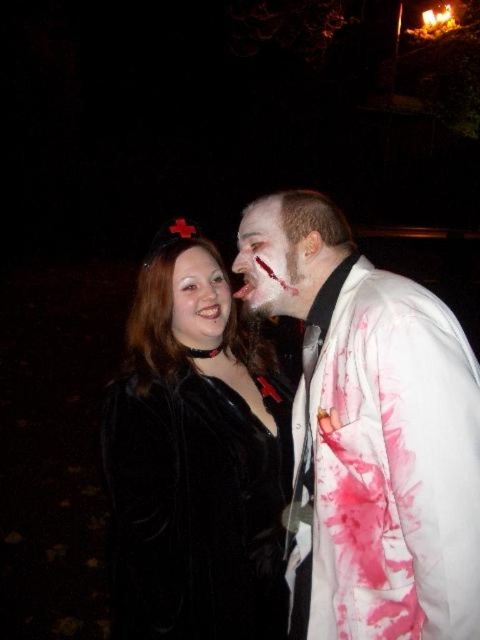
Question: Estimate the real-world distances between objects in this image. Which object is closer to the velvet black coat at center?

Choices:
 (A) white matte jacket at right
 (B) smooth black hair at center
 (C) blood-stained flesh at center

Answer: (B)

Question: Which point is closer to the camera taking this photo?

Choices:
 (A) (167, 340)
 (B) (384, 538)
 (C) (250, 236)

Answer: (B)

Question: Is blood-stained flesh at center smaller than smooth black hair at center?

Choices:
 (A) yes
 (B) no

Answer: (B)

Question: Is white matte jacket at right positioned behind velvet black coat at center?

Choices:
 (A) no
 (B) yes

Answer: (A)

Question: Does white matte jacket at right come in front of velvet black coat at center?

Choices:
 (A) no
 (B) yes

Answer: (B)

Question: Which object appears farthest from the camera in this image?

Choices:
 (A) velvet black coat at center
 (B) smooth black hair at center
 (C) blood-stained flesh at center

Answer: (B)